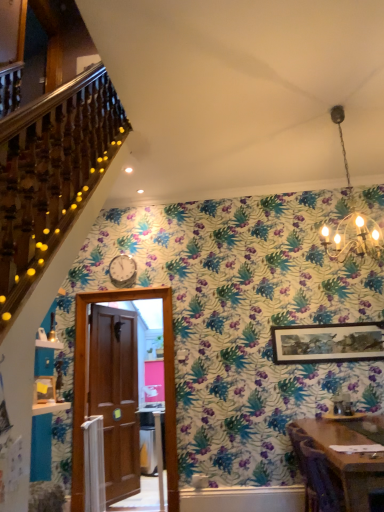
Question: Does point (367, 432) appear closer or farther from the camera than point (279, 331)?

Choices:
 (A) farther
 (B) closer

Answer: (B)

Question: From a real-world perspective, is wooden table at lower right positioned above or below wooden framed artwork at upper right?

Choices:
 (A) above
 (B) below

Answer: (B)

Question: Estimate the real-world distances between objects in this image. Which object is closer to the wooden table at lower right?

Choices:
 (A) wooden framed artwork at upper right
 (B) gold chain chandelier at upper center
 (C) brown wooden door at center

Answer: (A)

Question: Which object is the closest to the brown wooden door at center?

Choices:
 (A) wooden table at lower right
 (B) gold chain chandelier at upper center
 (C) wooden framed artwork at upper right

Answer: (C)